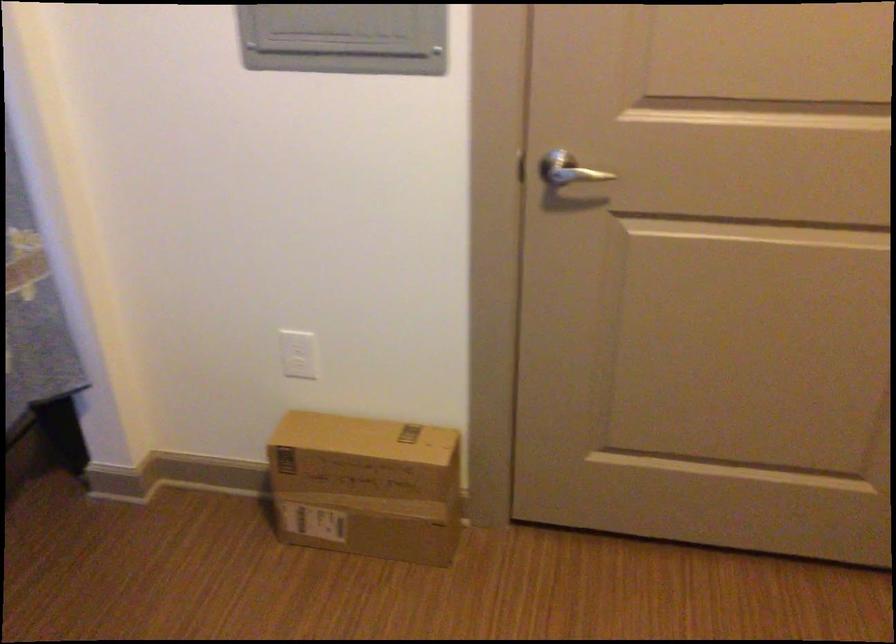
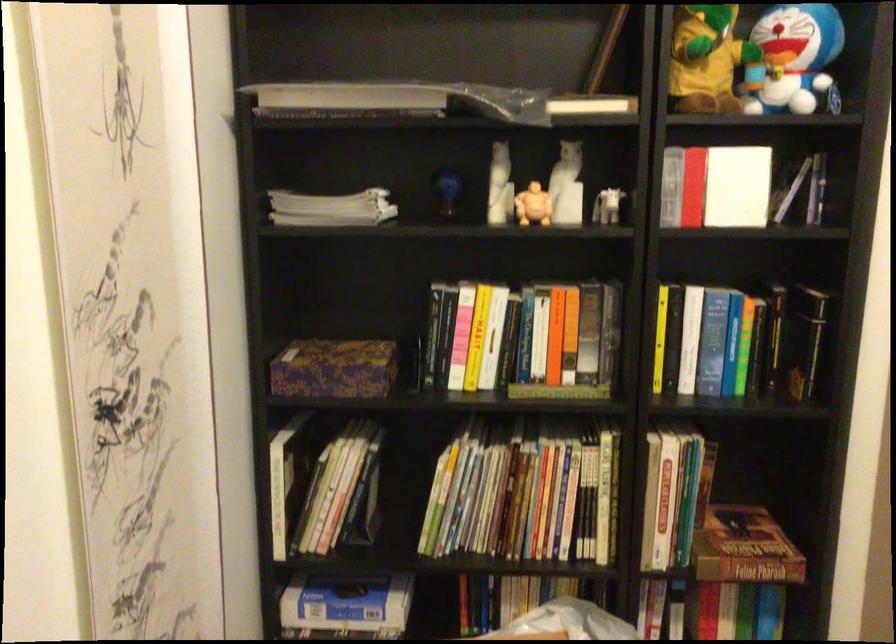
Question: Based on the continuous images, in which direction is the camera rotating? Reply with the corresponding letter.

Choices:
 (A) Left
 (B) Right
 (C) Up
 (D) Down

Answer: (B)